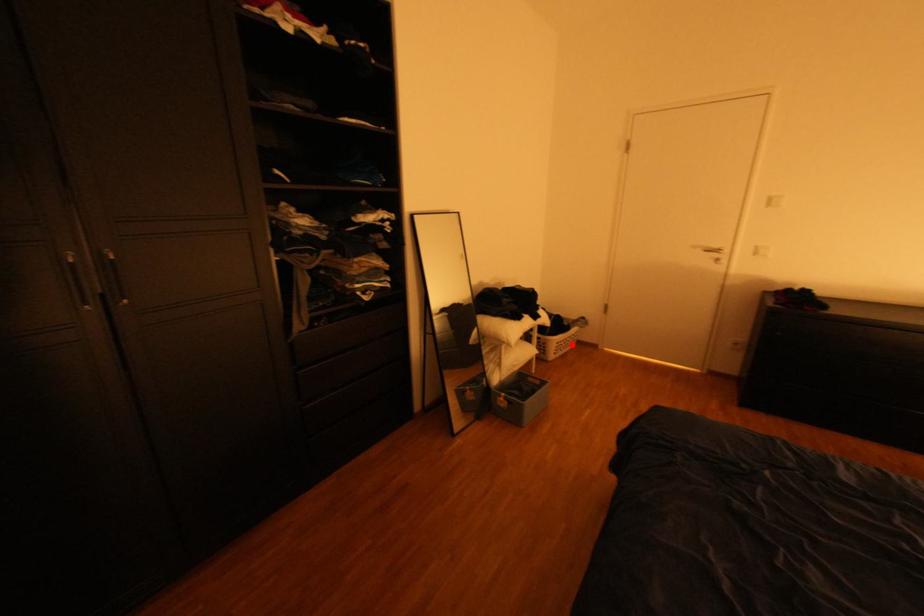
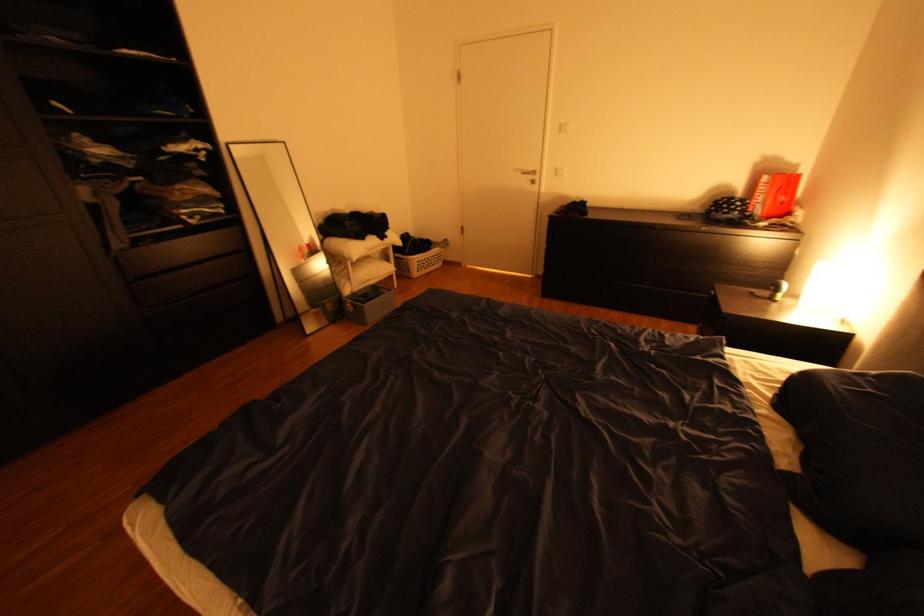
Question: I am providing you with two images of the same scene from different viewpoints. In image1, a red point is highlighted. Considering the same 3D point in image2, which of the following is correct?

Choices:
 (A) It is closer
 (B) It is farther

Answer: (A)